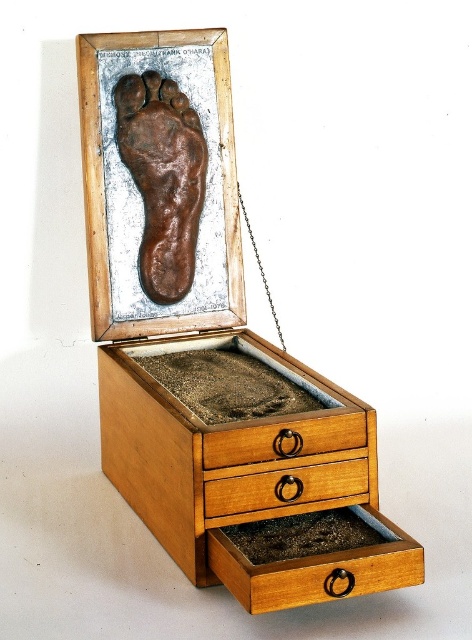
You are standing 1.06 meters away from the point at coordinates (246,572). If you walk forward 0.5 meters, will you be closer to the point?

Yes, because moving forward 0.5 meters towards the point at coordinates (246,572) reduces the distance from 1.06 meters to 0.56 meters, which is closer.

You are organizing a collection of artifacts and notice two drawers labeled wooden drawer at center and light brown wood drawer at center. Which drawer is above the other?

The wooden drawer at center is positioned over the light brown wood drawer at center, so the wooden drawer at center is above the light brown wood drawer at center.

You are holding a camera and want to take a photo of the brown clay foot at center. If you are standing 4.36 feet away from it, will you be able to capture the entire foot in your shot without moving closer?

The brown clay foot at center and camera are 4.36 feet apart. Whether you can capture the entire foot depends on your camera lens. A standard lens might require being closer, but a wide angle could work. However, the description does not provide lens details, so we can only confirm the distance.